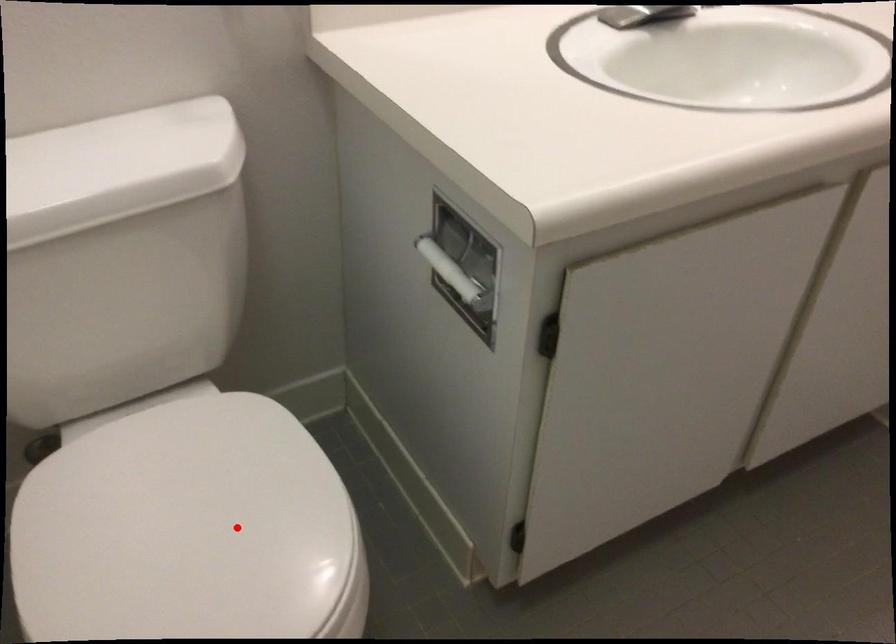
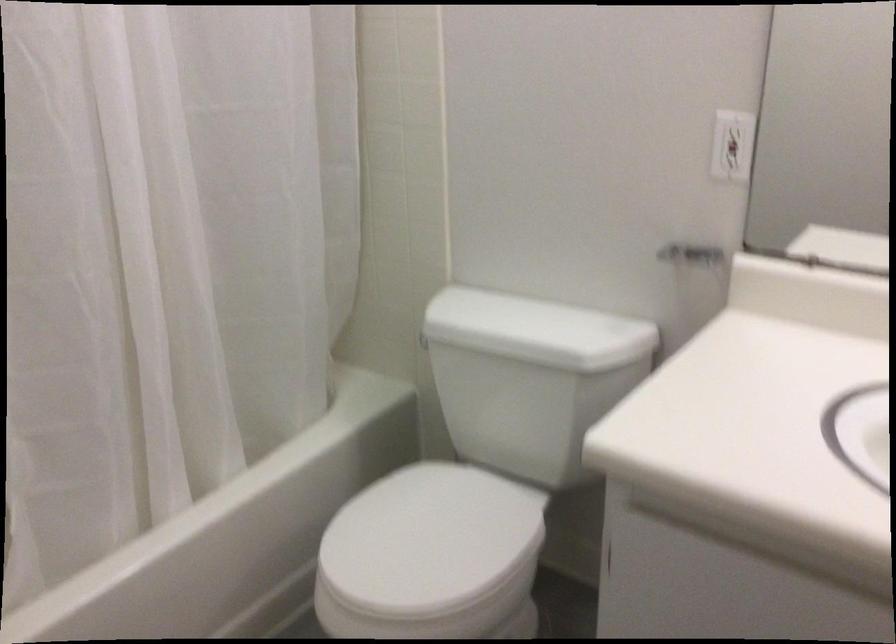
Find the pixel in the second image that matches the highlighted location in the first image.

(429, 540)